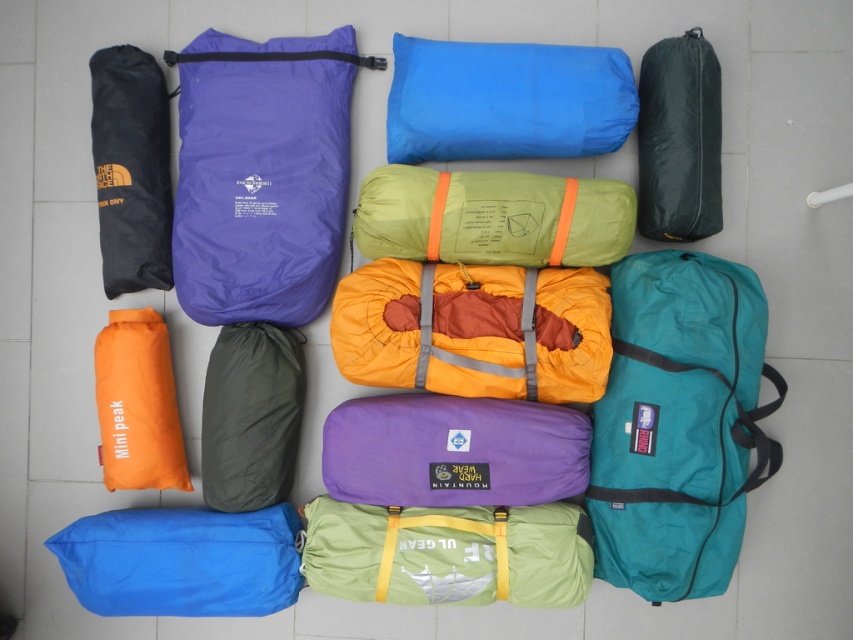
Question: Does green fabric sleeping bag at upper right have a smaller size compared to orange fabric sleeping bag at lower left?

Choices:
 (A) yes
 (B) no

Answer: (B)

Question: Is black nylon bag at upper left above green fabric sleeping bag at upper right?

Choices:
 (A) no
 (B) yes

Answer: (A)

Question: Which of these objects is positioned farthest from the black nylon bag at upper left?

Choices:
 (A) orange fabric sleeping bag at lower left
 (B) green fabric sleeping bag at upper right
 (C) teal fabric duffel at center right

Answer: (C)

Question: Which point is farther to the camera?

Choices:
 (A) (166, 486)
 (B) (149, 572)
 (C) (653, 397)
 (D) (155, 134)

Answer: (A)

Question: Is teal fabric duffel at center right smaller than blue fabric sleeping bag at center?

Choices:
 (A) no
 (B) yes

Answer: (A)

Question: Which of the following is the farthest from the observer?

Choices:
 (A) (624, 285)
 (B) (171, 410)
 (C) (683, 156)
 (D) (126, 288)

Answer: (B)